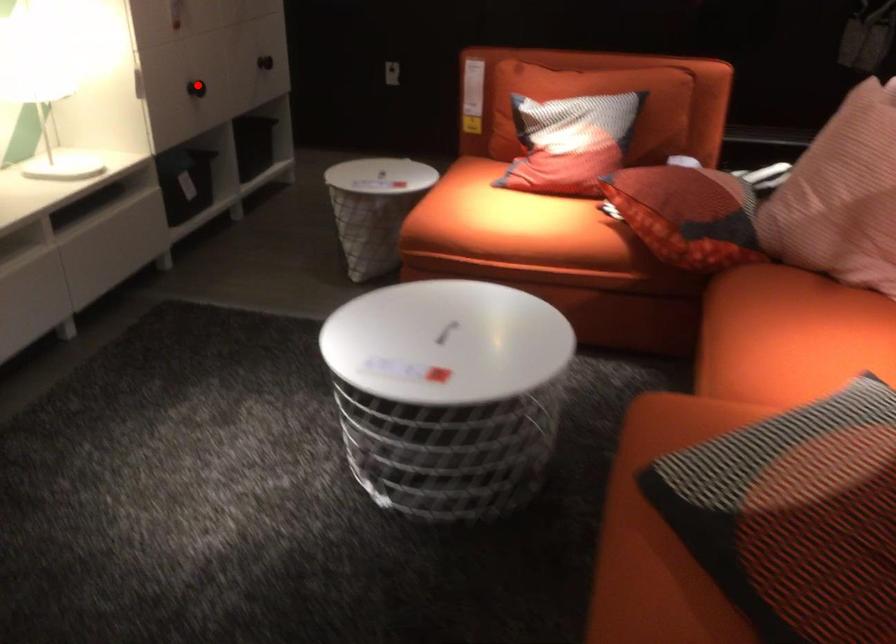
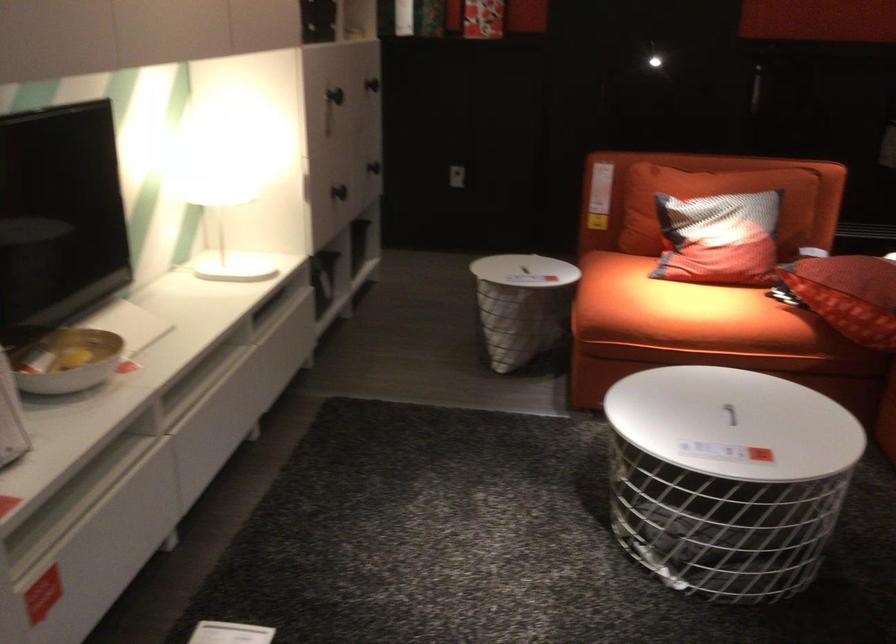
Find the pixel in the second image that matches the highlighted location in the first image.

(339, 192)